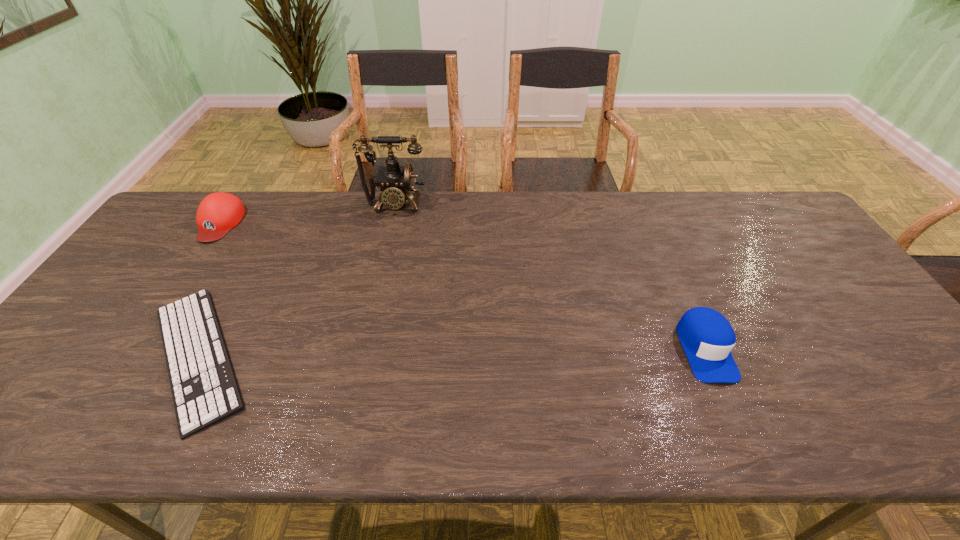
This screenshot has height=540, width=960. I want to click on the second object from right to left, so click(395, 181).

Identify the location of the tallest object. (395, 181).

This screenshot has width=960, height=540. Identify the location of the farther baseball cap. (219, 212).

Where is `the right baseball cap`? the right baseball cap is located at coordinates (707, 337).

Locate an element on the screen. The height and width of the screenshot is (540, 960). the rightmost object is located at coordinates (707, 337).

Find the location of `the shortest object`. the shortest object is located at coordinates pyautogui.click(x=204, y=389).

Image resolution: width=960 pixels, height=540 pixels. I want to click on vacant space located on the rotary dial of the tallest object, so click(x=380, y=273).

Locate an element on the screen. The height and width of the screenshot is (540, 960). vacant space located 0.340m on the front-facing side of the farther baseball cap is located at coordinates (146, 333).

This screenshot has width=960, height=540. In order to click on free point located 0.110m on the front-facing side of the nearer baseball cap in this screenshot , I will do `click(740, 431)`.

Locate an element on the screen. vacant space located 0.400m on the back of the computer keyboard is located at coordinates (278, 206).